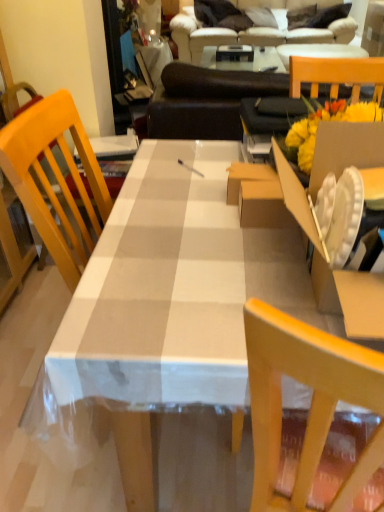
What is the approximate height of white checkered tablecloth at center?

white checkered tablecloth at center is 29.86 inches tall.

I want to click on cardboard box at right, so click(335, 271).

What is the approximate width of cardboard box at right?

The width of cardboard box at right is 13.25 inches.

Image resolution: width=384 pixels, height=512 pixels. I want to click on beige fabric couch at upper center, so click(248, 35).

Where is `white checkered tablecloth at center`? The height and width of the screenshot is (512, 384). white checkered tablecloth at center is located at coordinates (173, 302).

From the image's perspective, is cardboard box at right below wooden chair at right?

Yes.

Considering the positions of point (373, 159) and point (307, 70), is point (373, 159) closer or farther from the camera than point (307, 70)?

Point (373, 159) is positioned closer to the camera compared to point (307, 70).

Is cardboard box at right turned away from wooden chair at right?

cardboard box at right is not turned away from wooden chair at right.

Between cardboard box at right and wooden chair at right, which one has larger size?

Bigger between the two is cardboard box at right.

Is wooden chair at right closer to camera compared to white checkered tablecloth at center?

That is False.

Would you say wooden chair at right is a long distance from white checkered tablecloth at center?

No.

Would you say wooden chair at right is inside or outside white checkered tablecloth at center?

wooden chair at right cannot be found inside white checkered tablecloth at center.

Is wooden chair at right at the left side of white checkered tablecloth at center?

Incorrect, wooden chair at right is not on the left side of white checkered tablecloth at center.

Who is more distant, cardboard box at right or white checkered tablecloth at center?

white checkered tablecloth at center is more distant.

Looking at this image, is the surface of cardboard box at right in direct contact with white checkered tablecloth at center?

No, cardboard box at right is not in contact with white checkered tablecloth at center.

Can you confirm if cardboard box at right is positioned to the right of white checkered tablecloth at center?

Indeed, cardboard box at right is positioned on the right side of white checkered tablecloth at center.

From the picture: Considering the relative sizes of cardboard box at right and white checkered tablecloth at center in the image provided, is cardboard box at right smaller than white checkered tablecloth at center?

Yes, cardboard box at right is smaller than white checkered tablecloth at center.

Which object is positioned more to the right, white checkered tablecloth at center or cardboard box at right?

cardboard box at right is more to the right.

Is point (235, 440) closer or farther from the camera than point (380, 308)?

Point (235, 440).

Are white checkered tablecloth at center and cardboard box at right beside each other?

white checkered tablecloth at center is not next to cardboard box at right, and they're not touching.

Who is taller, white checkered tablecloth at center or cardboard box at right?

Standing taller between the two is white checkered tablecloth at center.

Between beige fabric couch at upper center and wooden chair at right, which one is positioned behind?

beige fabric couch at upper center is further away from the camera.

From a real-world perspective, which object rests below the other?

From a 3D spatial view, beige fabric couch at upper center is below.

Between beige fabric couch at upper center and wooden chair at right, which one has smaller width?

With smaller width is wooden chair at right.

How distant is beige fabric couch at upper center from wooden chair at right?

beige fabric couch at upper center and wooden chair at right are 3.08 meters apart from each other.

Are wooden chair at right and cardboard box at right located far from each other?

No, there isn't a large distance between wooden chair at right and cardboard box at right.

Identify the location of chair behind the cardboard box at right. (336, 74).

Looking at this image, is wooden chair at right not within cardboard box at right?

Yes, wooden chair at right is outside of cardboard box at right.

Can you confirm if wooden chair at right is positioned to the left of cardboard box at right?

No, wooden chair at right is not to the left of cardboard box at right.

From their relative heights in the image, would you say white checkered tablecloth at center is taller or shorter than beige fabric couch at upper center?

Clearly, white checkered tablecloth at center is shorter compared to beige fabric couch at upper center.

Does white checkered tablecloth at center have a greater width compared to beige fabric couch at upper center?

Yes.

Is white checkered tablecloth at center oriented away from beige fabric couch at upper center?

Yes, white checkered tablecloth at center is facing away from beige fabric couch at upper center.

The image size is (384, 512). I want to click on desk in front of the beige fabric couch at upper center, so [x=173, y=302].

This screenshot has height=512, width=384. Identify the location of chair that appears on the right of cardboard box at right. (336, 74).

At what (x,y) coordinates should I click in order to perform the action: click on desk lying in front of the wooden chair at right. Please return your answer as a coordinate pair (x, y). Looking at the image, I should click on (173, 302).

Considering their positions, is beige fabric couch at upper center positioned closer to cardboard box at right than white checkered tablecloth at center?

white checkered tablecloth at center is positioned closer to the anchor cardboard box at right.

Based on their spatial positions, is cardboard box at right or wooden chair at right closer to white checkered tablecloth at center?

cardboard box at right.

Estimate the real-world distances between objects in this image. Which object is further from beige fabric couch at upper center, cardboard box at right or white checkered tablecloth at center?

cardboard box at right is positioned further to the anchor beige fabric couch at upper center.

Looking at this image, which object lies further to the anchor point white checkered tablecloth at center, cardboard box at right or beige fabric couch at upper center?

beige fabric couch at upper center is further to white checkered tablecloth at center.

When comparing their distances from wooden chair at right, does white checkered tablecloth at center or beige fabric couch at upper center seem further?

beige fabric couch at upper center is further to wooden chair at right.

Looking at the image, which one is located further to wooden chair at right, cardboard box at right or white checkered tablecloth at center?

Among the two, white checkered tablecloth at center is located further to wooden chair at right.

When comparing their distances from cardboard box at right, does white checkered tablecloth at center or wooden chair at right seem closer?

Among the two, white checkered tablecloth at center is located nearer to cardboard box at right.

Looking at the image, which one is located closer to white checkered tablecloth at center, wooden chair at right or cardboard box at right?

Among the two, cardboard box at right is located nearer to white checkered tablecloth at center.

Identify the location of desk located between cardboard box at right and beige fabric couch at upper center in the depth direction. [x=173, y=302].

I want to click on desk between cardboard box at right and wooden chair at right in the front-back direction, so click(x=173, y=302).

You are a GUI agent. You are given a task and a screenshot of the screen. Output one action in this format:
    pyautogui.click(x=<x>, y=<y>)
    Task: Click on the chair between cardboard box at right and beige fabric couch at upper center in the front-back direction
    The height and width of the screenshot is (512, 384).
    Given the screenshot: What is the action you would take?
    pyautogui.click(x=336, y=74)

Where is `chair between white checkered tablecloth at center and beige fabric couch at upper center from front to back`? chair between white checkered tablecloth at center and beige fabric couch at upper center from front to back is located at coordinates (336, 74).